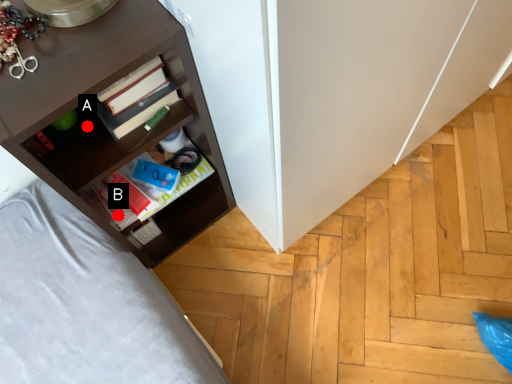
Question: Two points are circled on the image, labeled by A and B beside each circle. Which point appears farthest from the camera in this image?

Choices:
 (A) A is further
 (B) B is further

Answer: (B)